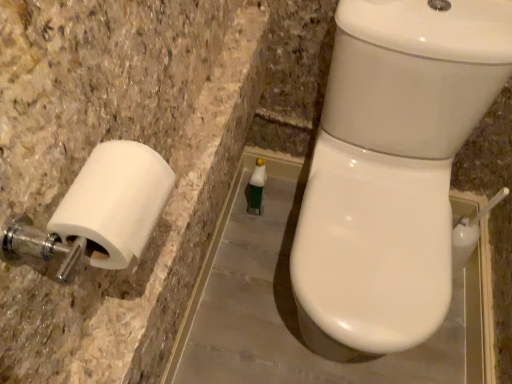
Question: Is white matte toilet paper at left bigger or smaller than white glossy toilet at right?

Choices:
 (A) big
 (B) small

Answer: (B)

Question: Do you think white matte toilet paper at left is within white glossy toilet at right, or outside of it?

Choices:
 (A) inside
 (B) outside

Answer: (B)

Question: Estimate the real-world distances between objects in this image. Which object is farther from the white matte toilet paper at left?

Choices:
 (A) white glossy toilet at right
 (B) green matte bottle at center

Answer: (B)

Question: Estimate the real-world distances between objects in this image. Which object is closer to the white glossy toilet at right?

Choices:
 (A) green matte bottle at center
 (B) white matte toilet paper at left

Answer: (A)